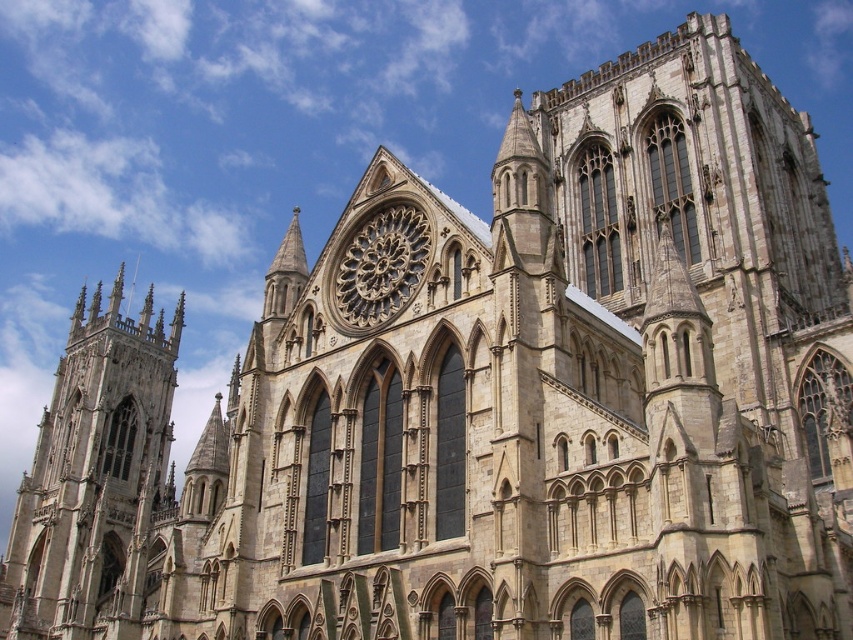
Question: Among these objects, which one is farthest from the camera?

Choices:
 (A) stone gothic tower at left
 (B) golden stone rose window at center

Answer: (A)

Question: Does stone gothic tower at left appear under golden stone rose window at center?

Choices:
 (A) no
 (B) yes

Answer: (B)

Question: Which object appears closest to the camera in this image?

Choices:
 (A) golden stone rose window at center
 (B) stone gothic tower at left

Answer: (A)

Question: Among these objects, which one is farthest from the camera?

Choices:
 (A) stone gothic tower at left
 (B) golden stone rose window at center

Answer: (A)

Question: Can you confirm if stone gothic tower at left is positioned to the left of golden stone rose window at center?

Choices:
 (A) yes
 (B) no

Answer: (A)

Question: Does stone gothic tower at left appear under golden stone rose window at center?

Choices:
 (A) yes
 (B) no

Answer: (A)